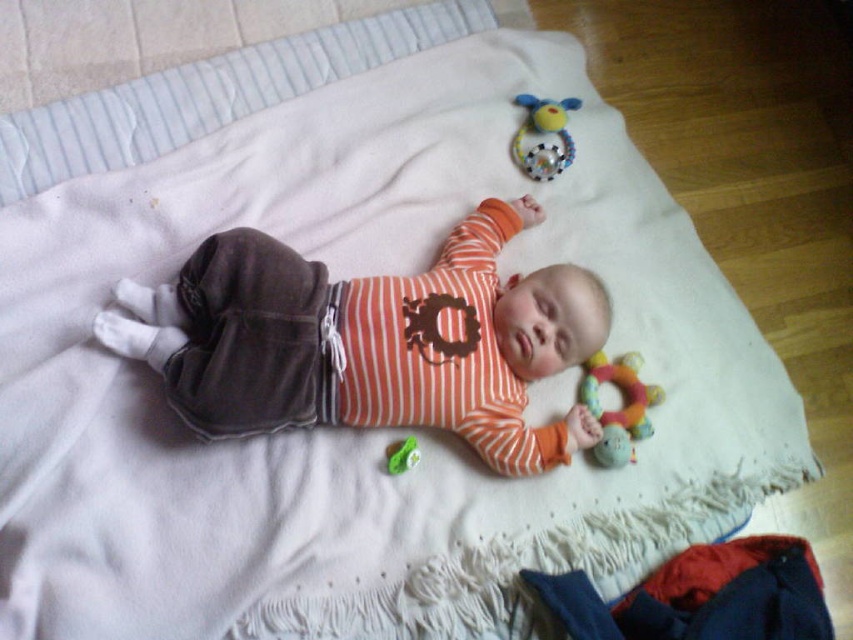
You are taking a photo of the baby and want to focus on both point (479, 324) and point (535, 124). Which point should you focus on first to ensure the baby stays in focus?

You should focus on point (479, 324) first because it is closer to the camera than point (535, 124).